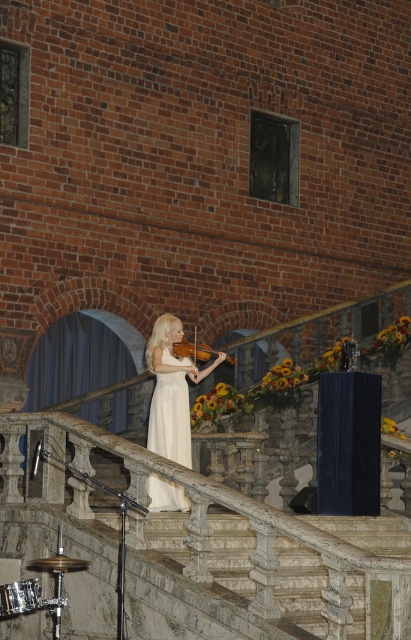
Question: Does white satin dress at center have a greater width compared to wooden violin at center?

Choices:
 (A) no
 (B) yes

Answer: (B)

Question: Which point is farther from the camera taking this photo?

Choices:
 (A) (30, 589)
 (B) (191, 346)
 (C) (152, 497)
 (D) (182, 440)

Answer: (D)

Question: Based on their relative distances, which object is nearer to the white satin dress at center?

Choices:
 (A) shiny silver drum at lower left
 (B) white silk dress at center
 (C) wooden violin at center

Answer: (B)

Question: Does white silk dress at center appear on the right side of shiny silver drum at lower left?

Choices:
 (A) yes
 (B) no

Answer: (A)

Question: Is white silk dress at center above shiny silver drum at lower left?

Choices:
 (A) yes
 (B) no

Answer: (A)

Question: Which point appears farthest from the camera in this image?

Choices:
 (A) click(177, 353)
 (B) click(6, 592)
 (C) click(159, 445)

Answer: (A)